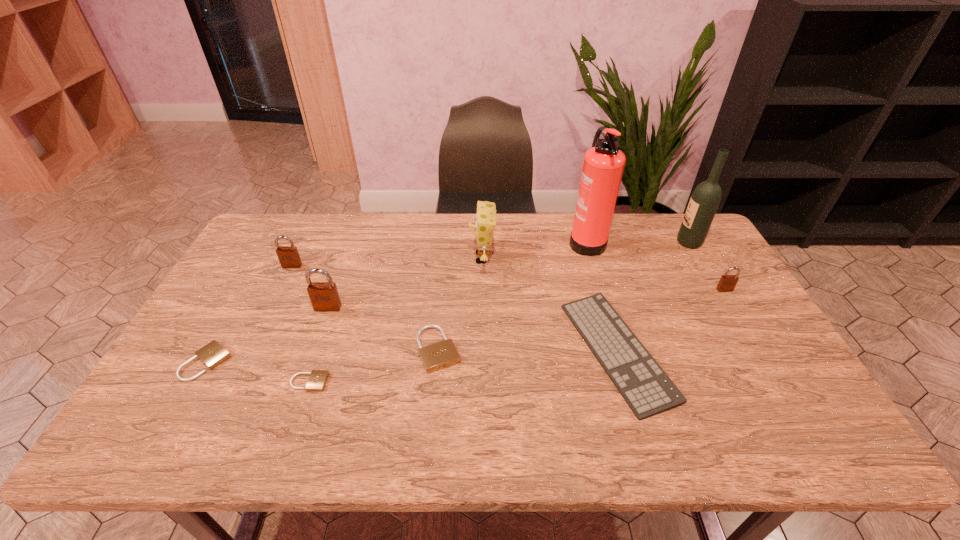
Identify the location of brown padlock that is the closest to the second smallest beige padlock. This screenshot has height=540, width=960. (324, 296).

Locate an element on the screen. brown padlock identified as the third closest to the second smallest beige padlock is located at coordinates (727, 283).

Identify which beige padlock is the second closest to the ninth shortest object. Please provide its 2D coordinates. Your answer should be formatted as a tuple, i.e. [(x, y)], where the tuple contains the x and y coordinates of a point satisfying the conditions above.

[(317, 380)]

You are a GUI agent. You are given a task and a screenshot of the screen. Output one action in this format:
    pyautogui.click(x=<x>, y=<y>)
    Task: Click on the beige padlock identified as the second closest to the green wine bottle
    
    Given the screenshot: What is the action you would take?
    pyautogui.click(x=317, y=380)

This screenshot has width=960, height=540. What are the coordinates of `free space that satisfies the following two spatial constraints: 1. on the labeled side of the green wine bottle; 2. on the front-facing side of the third farthest padlock` in the screenshot? It's located at (727, 308).

What are the coordinates of `free location that satisfies the following two spatial constraints: 1. on the labeled side of the ninth shortest object; 2. on the front-facing side of the ninth object from right to left` in the screenshot? It's located at (702, 266).

The width and height of the screenshot is (960, 540). I want to click on vacant space that satisfies the following two spatial constraints: 1. on the front-facing side of the shortest object; 2. on the right side of the biggest brown padlock, so click(301, 382).